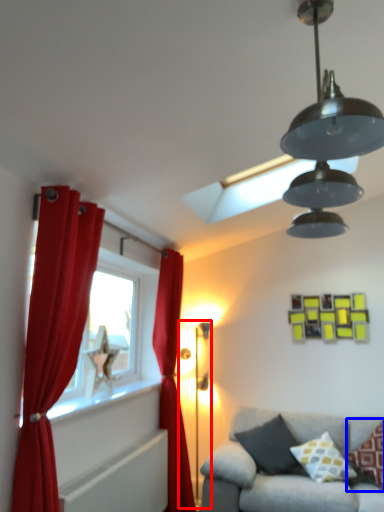
Question: Among these objects, which one is nearest to the camera, table lamp (highlighted by a red box) or pillow (highlighted by a blue box)?

Choices:
 (A) table lamp
 (B) pillow

Answer: (B)